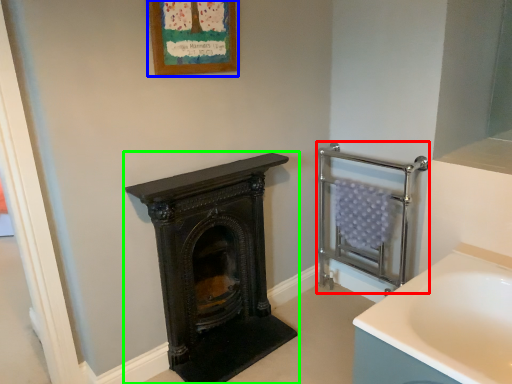
Question: Which object is positioned closest to balustrade (highlighted by a red box)? Select from picture frame (highlighted by a blue box) and wood burning stove (highlighted by a green box).

Choices:
 (A) picture frame
 (B) wood burning stove

Answer: (B)